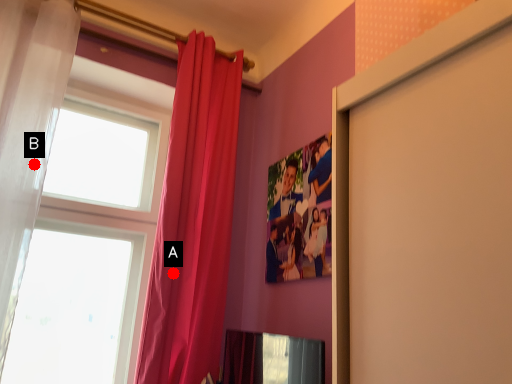
Question: Two points are circled on the image, labeled by A and B beside each circle. Which point is farther from the camera taking this photo?

Choices:
 (A) A is further
 (B) B is further

Answer: (A)